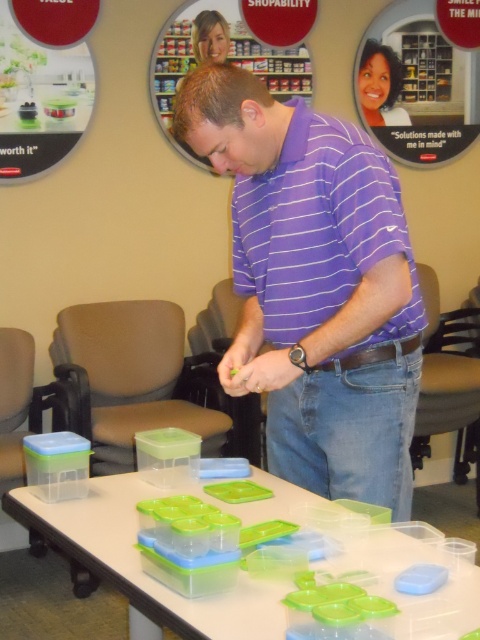
You are a person looking at the scene. Can you see the clear plastic containers at center through the purple striped shirt at center?

The clear plastic containers at center is behind purple striped shirt at center, so you cannot see the clear plastic containers at center through the purple striped shirt at center.

You are a photographer trying to capture a closeup of the clear plastic containers at center without the purple striped shirt at center blocking the view. Is the shirt currently in the way?

The purple striped shirt at center is positioned over clear plastic containers at center, so it is blocking the view of the clear plastic containers at center. To capture a clear shot, you would need to adjust the angle or have the person move the shirt out of the way.

You are a photographer taking a picture of the clear plastic containers at center and the purple striped shirt at center. To ensure both are in frame, where should you position the camera relative to the scene?

The purple striped shirt at center is to the right of the clear plastic containers at center, so position the camera so it captures both objects by framing the scene with the shirt on the right side and the containers on the left side.